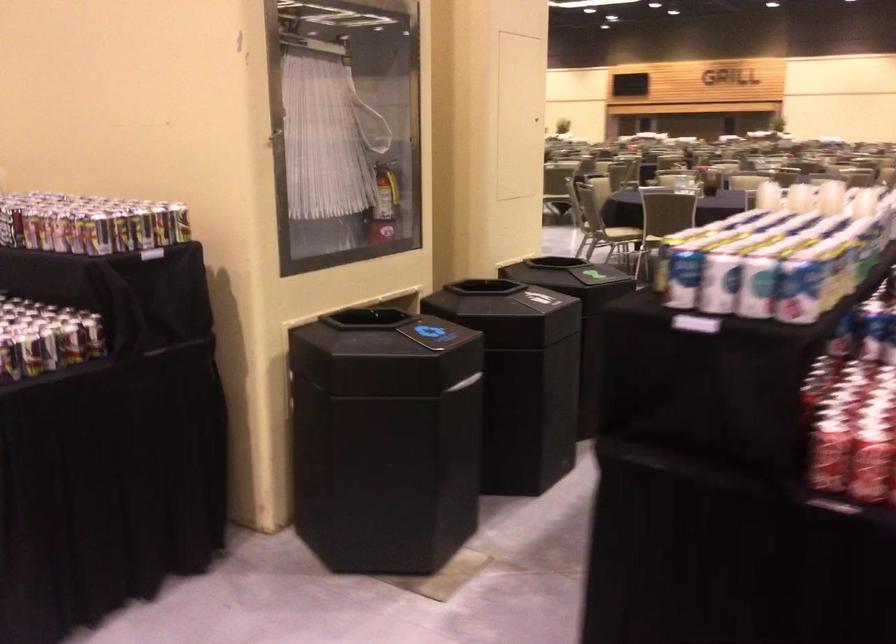
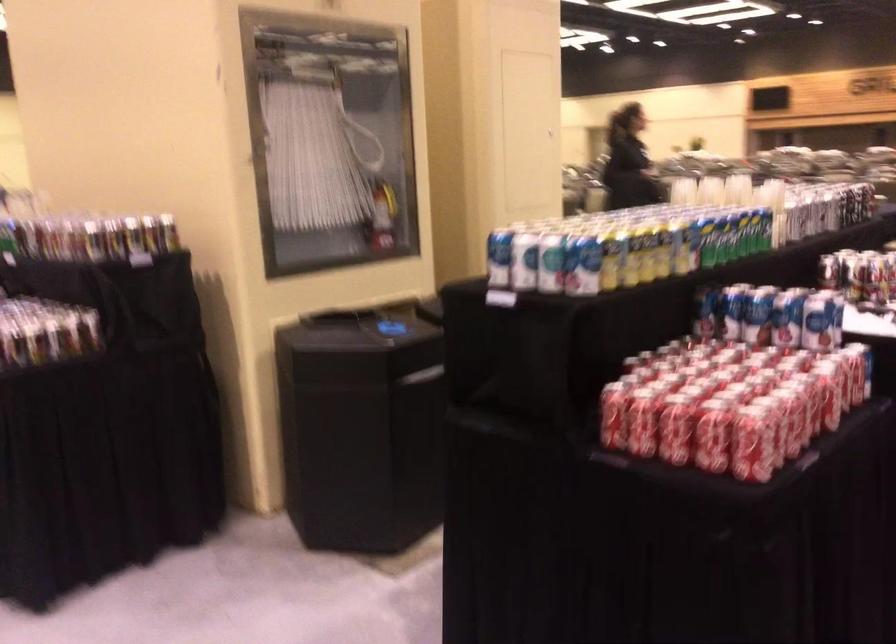
Where in the second image is the point corresponding to pixel 820 449 from the first image?

(613, 413)